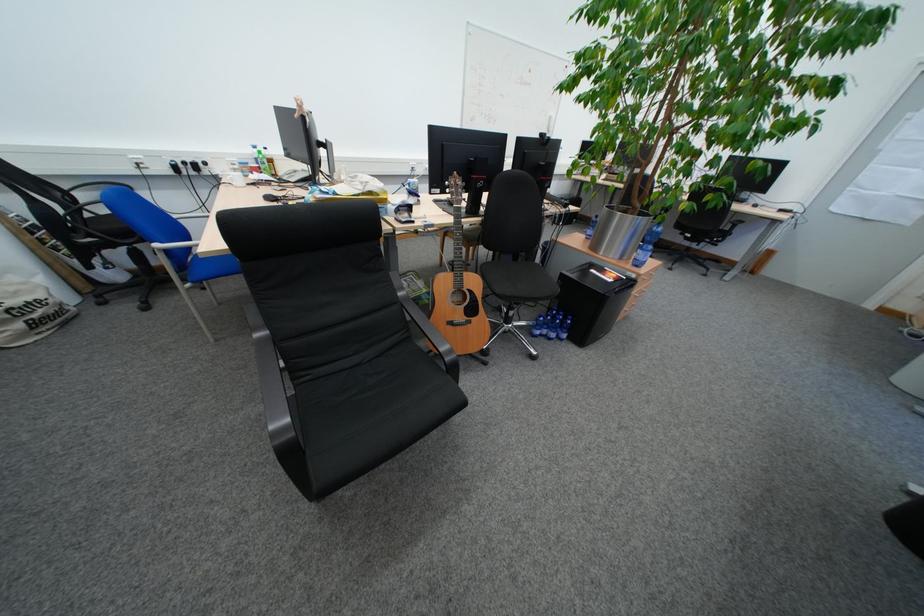
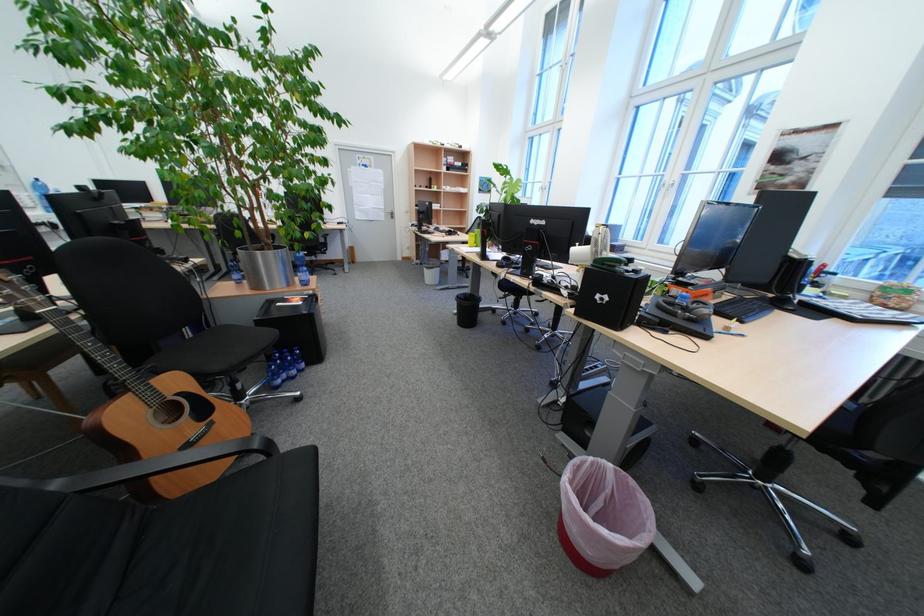
Where in the second image is the point corresponding to point 485,283 from the first image?

(187, 383)